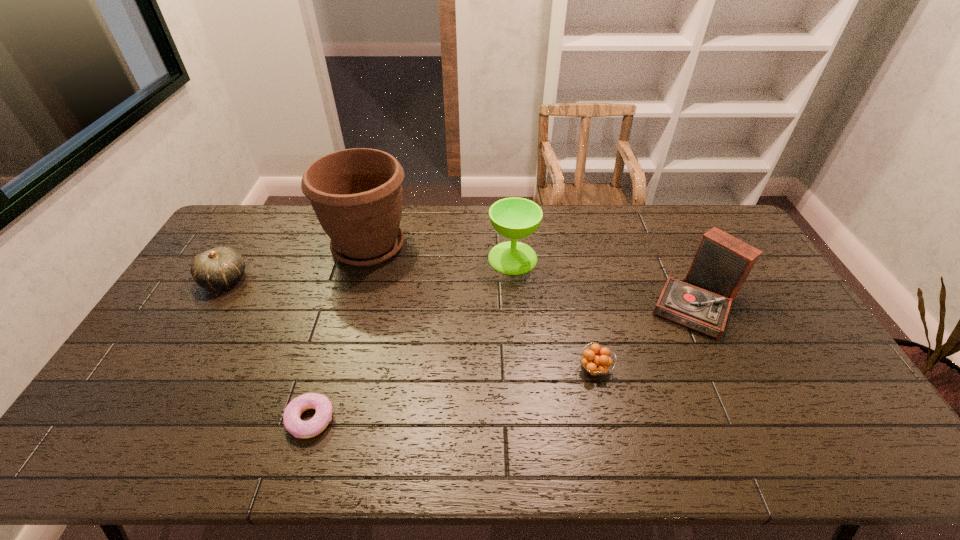
Identify the location of free space located 0.240m on the front of the wineglass. Image resolution: width=960 pixels, height=540 pixels. (518, 331).

This screenshot has height=540, width=960. Identify the location of vacant area located 0.110m on the back of the phonograph record. (673, 251).

Where is `vacant space located 0.400m on the front of the leftmost object`? vacant space located 0.400m on the front of the leftmost object is located at coordinates (147, 411).

At what (x,y) coordinates should I click in order to perform the action: click on vacant space located on the right of the fifth tallest object. Please return your answer as a coordinate pair (x, y). This screenshot has width=960, height=540. Looking at the image, I should click on (685, 369).

Find the location of a particular element. This screenshot has width=960, height=540. free space located on the right of the doughnut is located at coordinates (467, 420).

The height and width of the screenshot is (540, 960). What are the coordinates of `flowerpot that is at the far edge` in the screenshot? It's located at (356, 194).

Find the location of a particular element. wineglass located in the far edge section of the desktop is located at coordinates (515, 218).

Where is `object that is at the near edge`? The image size is (960, 540). object that is at the near edge is located at coordinates (293, 424).

Identify the location of object located in the left edge section of the desktop. (220, 267).

Identify the location of object located in the right edge section of the desktop. The image size is (960, 540). pos(722,263).